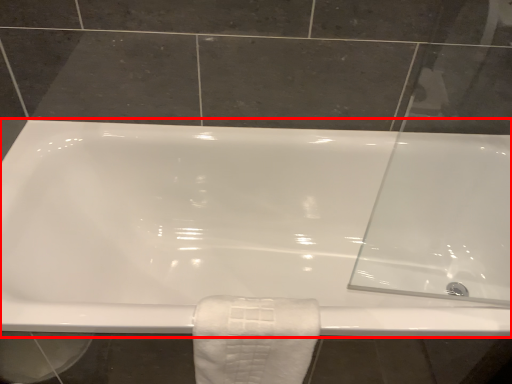
Question: From the image, what is the correct spatial relationship of bathtub (annotated by the red box) in relation to towel?

Choices:
 (A) right
 (B) left

Answer: (A)